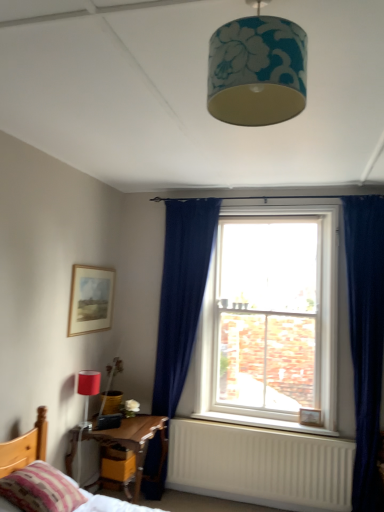
Question: Visually, is wooden bed at lower left positioned to the left or to the right of teal floral fabric lampshade at upper center, which is the 1th lamp from right to left?

Choices:
 (A) left
 (B) right

Answer: (A)

Question: From the image's perspective, is wooden bed at lower left positioned above or below teal floral fabric lampshade at upper center, the 2th lamp in the left-to-right sequence?

Choices:
 (A) above
 (B) below

Answer: (B)

Question: Which object is the closest to the striped fabric pillow at lower left?

Choices:
 (A) wooden picture frame at lower right, which is counted as the first picture frame, starting from the bottom
 (B) teal floral fabric lampshade at upper center, acting as the 2th lamp starting from the back
 (C) clear glass window at center
 (D) yellow wood drawer at lower left
 (E) wooden bed at lower left

Answer: (E)

Question: Which of these objects is positioned farthest from the matte red lampshade at lower left, the 1th lamp from the bottom?

Choices:
 (A) striped fabric pillow at lower left
 (B) clear glass window at center
 (C) matte gold picture frame at upper left, which is the first picture frame from left to right
 (D) white painted wood at lower center
 (E) wooden bed at lower left

Answer: (B)